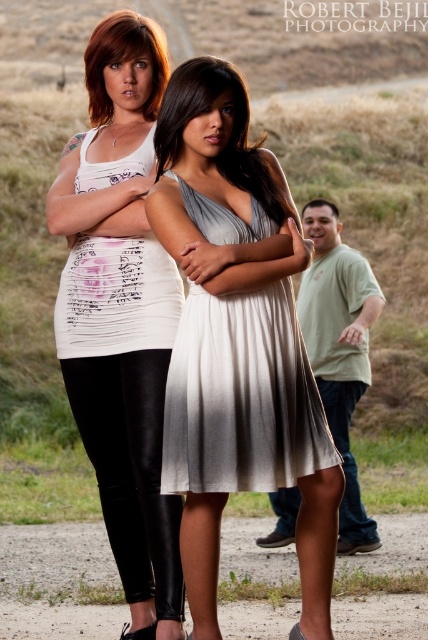
Is point (151, 36) positioned after point (332, 204)?

No, it is not.

At what (x,y) coordinates should I click in order to perform the action: click on shiny brown hair at upper left. Please return your answer as a coordinate pair (x, y). The height and width of the screenshot is (640, 428). Looking at the image, I should click on (124, 60).

Is the position of green matte shirt at right more distant than that of matte gray dress at center?

That is False.

Is green matte shirt at right thinner than matte gray dress at center?

Yes, green matte shirt at right is thinner than matte gray dress at center.

The height and width of the screenshot is (640, 428). What are the coordinates of `green matte shirt at right` in the screenshot? It's located at (362, 321).

Who is higher up, satin dress at center or matte gray dress at center?

matte gray dress at center is above.

Does satin dress at center appear on the left side of matte gray dress at center?

Yes, satin dress at center is to the left of matte gray dress at center.

Is point (241, 125) closer to viewer compared to point (314, 202)?

Yes, point (241, 125) is in front of point (314, 202).

Locate an element on the screen. The width and height of the screenshot is (428, 640). satin dress at center is located at coordinates (231, 132).